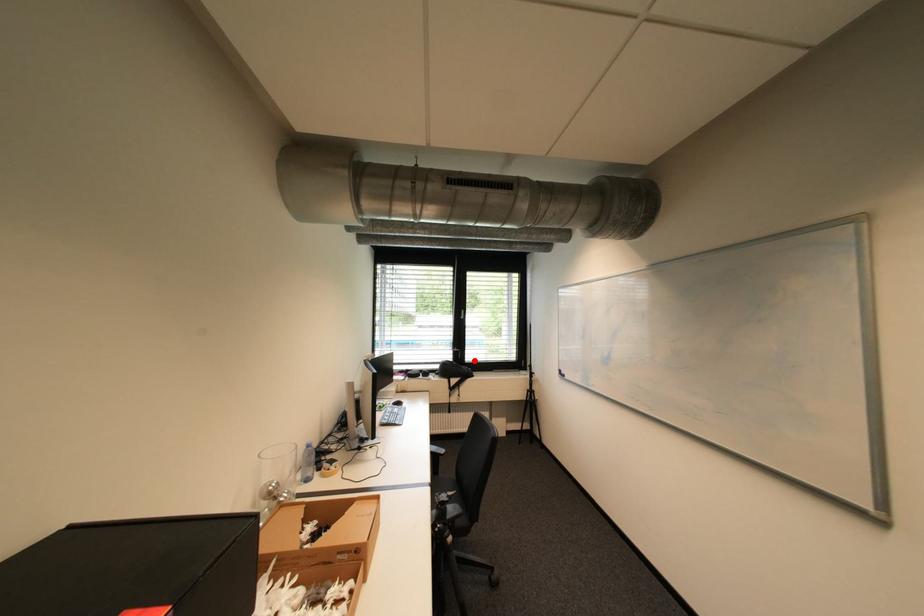
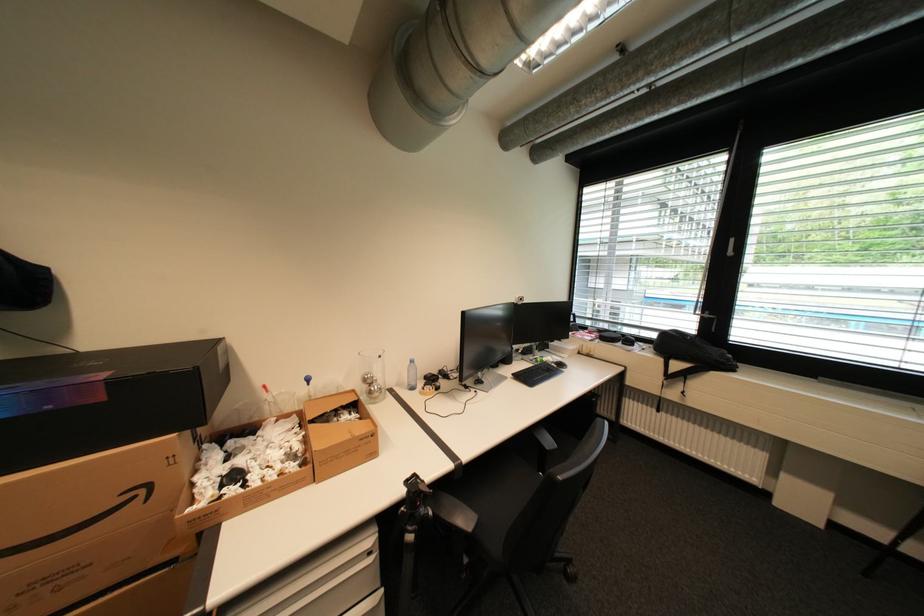
The point at the highlighted location is marked in the first image. Where is the corresponding point in the second image?

(739, 339)